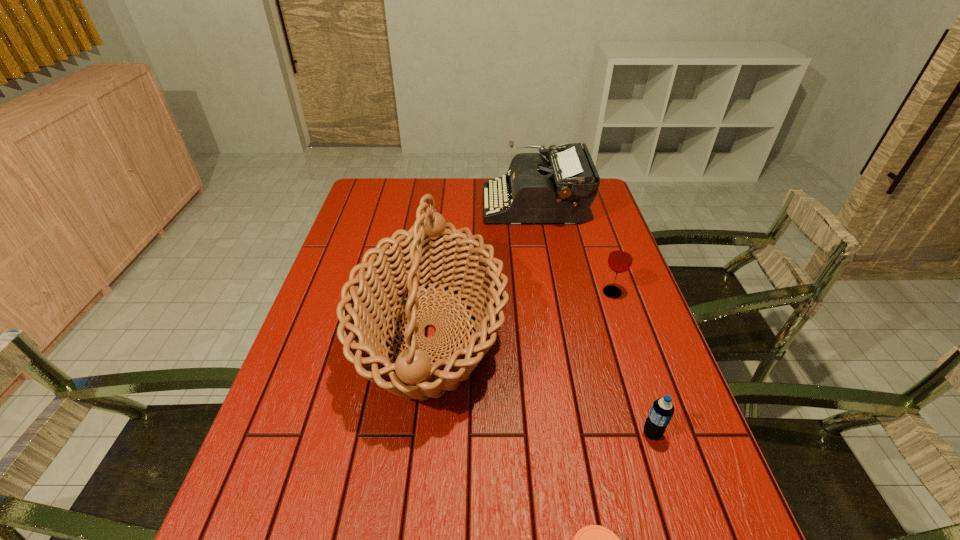
Identify the location of free spot between the tallest object and the second shortest object. The image size is (960, 540). (540, 383).

Image resolution: width=960 pixels, height=540 pixels. I want to click on free space between the farthest object and the soda bottle, so click(593, 319).

Locate an element on the screen. This screenshot has width=960, height=540. empty space between the third shortest object and the tallest object is located at coordinates [x=521, y=313].

The image size is (960, 540). I want to click on vacant region between the second shortest object and the basket, so click(x=540, y=383).

The height and width of the screenshot is (540, 960). I want to click on free space between the glass and the typewriter, so click(x=573, y=248).

Locate which object is the closest to the third tallest object. Please provide its 2D coordinates. Your answer should be formatted as a tuple, i.e. [(x, y)], where the tuple contains the x and y coordinates of a point satisfying the conditions above.

[(561, 190)]

Identify which object is located as the nearest to the third shortest object. Please provide its 2D coordinates. Your answer should be formatted as a tuple, i.e. [(x, y)], where the tuple contains the x and y coordinates of a point satisfying the conditions above.

[(561, 190)]

Locate an element on the screen. This screenshot has height=540, width=960. vacant position in the image that satisfies the following two spatial constraints: 1. on the back side of the glass; 2. on the left side of the fourth tallest object is located at coordinates (607, 293).

At what (x,y) coordinates should I click in order to perform the action: click on free space in the image that satisfies the following two spatial constraints: 1. on the front-facing side of the typewriter; 2. on the left side of the glass. Please return your answer as a coordinate pair (x, y). The height and width of the screenshot is (540, 960). Looking at the image, I should click on [x=550, y=293].

Locate an element on the screen. vacant region that satisfies the following two spatial constraints: 1. on the front side of the tallest object; 2. on the right side of the soda bottle is located at coordinates (419, 433).